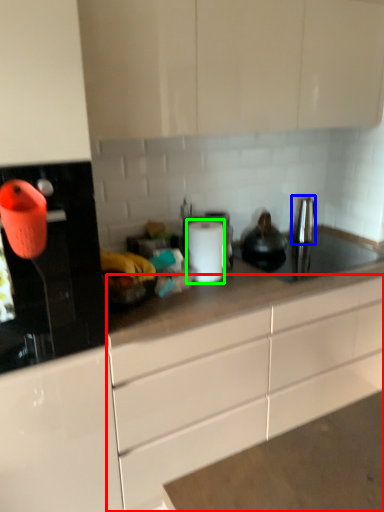
Question: Estimate the real-world distances between objects in this image. Which object is closer to cabinetry (highlighted by a red box), faucet (highlighted by a blue box) or paper towel (highlighted by a green box)?

Choices:
 (A) faucet
 (B) paper towel

Answer: (B)